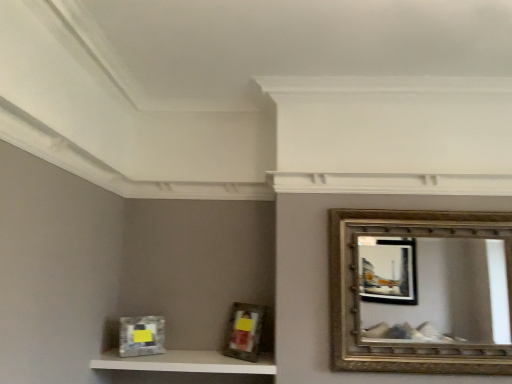
I want to click on vacant region above white textured shelf at lower left (from a real-world perspective), so click(190, 357).